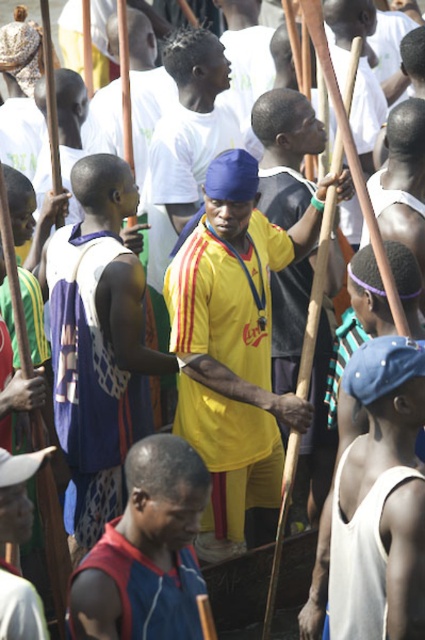
Does point (232, 464) lie behind point (121, 621)?

That is True.

Is the position of yellow matte shirt at center less distant than that of reddish-brown fabric shirt at lower left?

No, it is behind reddish-brown fabric shirt at lower left.

Locate an element on the screen. The height and width of the screenshot is (640, 425). yellow matte shirt at center is located at coordinates (234, 346).